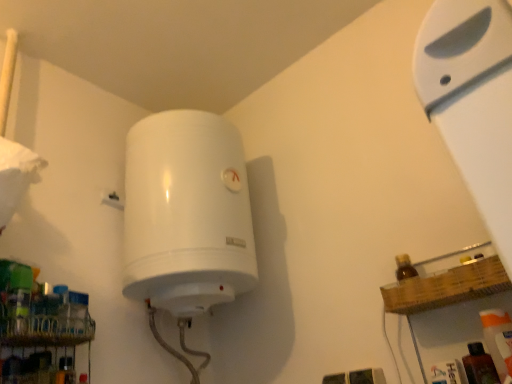
Question: From a real-world perspective, is white plastic shelf at upper right under translucent plastic spray bottle at lower right?

Choices:
 (A) no
 (B) yes

Answer: (A)

Question: Is white plastic shelf at upper right at the right side of translucent plastic spray bottle at lower right?

Choices:
 (A) no
 (B) yes

Answer: (A)

Question: Does white plastic shelf at upper right have a larger size compared to translucent plastic spray bottle at lower right?

Choices:
 (A) no
 (B) yes

Answer: (B)

Question: Is white plastic shelf at upper right behind translucent plastic spray bottle at lower right?

Choices:
 (A) no
 (B) yes

Answer: (A)

Question: Is white plastic shelf at upper right placed right next to translucent plastic spray bottle at lower right?

Choices:
 (A) no
 (B) yes

Answer: (A)

Question: Which is correct: white plastic shelf at upper right is inside translucent plastic spray bottle at lower right, or outside of it?

Choices:
 (A) outside
 (B) inside

Answer: (A)

Question: Looking at the image, does white plastic shelf at upper right seem bigger or smaller compared to translucent plastic spray bottle at lower right?

Choices:
 (A) big
 (B) small

Answer: (A)

Question: Is point (465, 33) closer or farther from the camera than point (492, 321)?

Choices:
 (A) farther
 (B) closer

Answer: (B)

Question: From the image's perspective, relative to translucent plastic spray bottle at lower right, is white plastic shelf at upper right above or below?

Choices:
 (A) above
 (B) below

Answer: (A)

Question: Is translucent plastic spray bottle at lower right inside the boundaries of metallic wire rack at lower left, or outside?

Choices:
 (A) outside
 (B) inside

Answer: (A)

Question: Is point (498, 326) positioned closer to the camera than point (51, 301)?

Choices:
 (A) closer
 (B) farther

Answer: (A)

Question: Considering the positions of translucent plastic spray bottle at lower right and metallic wire rack at lower left in the image, is translucent plastic spray bottle at lower right wider or thinner than metallic wire rack at lower left?

Choices:
 (A) thin
 (B) wide

Answer: (B)

Question: Considering the positions of translucent plastic spray bottle at lower right and metallic wire rack at lower left in the image, is translucent plastic spray bottle at lower right taller or shorter than metallic wire rack at lower left?

Choices:
 (A) tall
 (B) short

Answer: (A)

Question: Is translucent plastic spray bottle at lower right taller or shorter than white plastic shelf at upper right?

Choices:
 (A) tall
 (B) short

Answer: (B)

Question: Based on their sizes in the image, would you say translucent plastic spray bottle at lower right is bigger or smaller than white plastic shelf at upper right?

Choices:
 (A) big
 (B) small

Answer: (B)